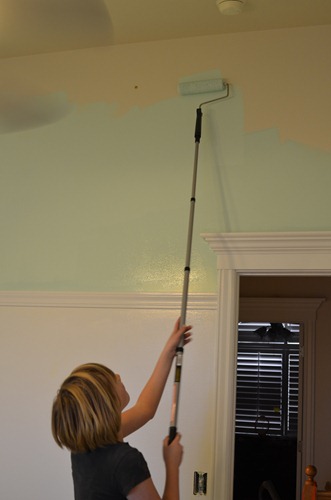
Where is `bedpost`? Image resolution: width=331 pixels, height=500 pixels. bedpost is located at coordinates (313, 470).